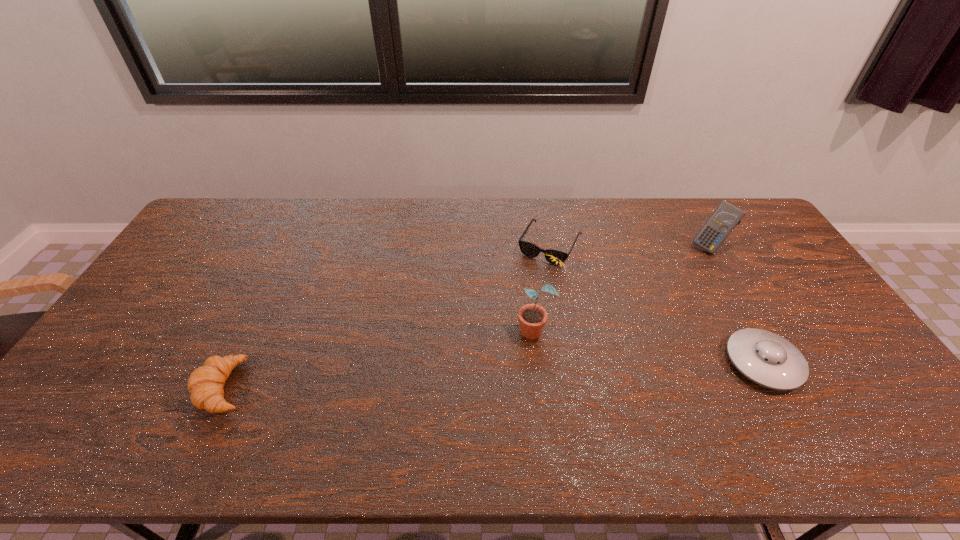
This screenshot has width=960, height=540. What are the coordinates of `vacant space at the far edge of the desktop` in the screenshot? It's located at (281, 202).

Identify the location of free region at the near edge of the desktop. (344, 410).

Where is `free region at the right edge of the desktop`? free region at the right edge of the desktop is located at coordinates (818, 323).

Where is `vacant region between the saucer and the calculator`? The width and height of the screenshot is (960, 540). vacant region between the saucer and the calculator is located at coordinates (736, 305).

Locate an element on the screen. This screenshot has height=540, width=960. vacant space that is in between the leftmost object and the fourth shortest object is located at coordinates (467, 317).

Locate an element on the screen. This screenshot has width=960, height=540. free spot between the sunglasses and the saucer is located at coordinates (657, 303).

Locate an element on the screen. The width and height of the screenshot is (960, 540). free space that is in between the sunglasses and the saucer is located at coordinates (657, 303).

I want to click on vacant space that is in between the fourth shortest object and the saucer, so click(x=736, y=305).

At what (x,y) coordinates should I click in order to perform the action: click on free space that is in between the calculator and the saucer. Please return your answer as a coordinate pair (x, y). The width and height of the screenshot is (960, 540). Looking at the image, I should click on (736, 305).

At what (x,y) coordinates should I click in order to perform the action: click on free point between the sunglasses and the calculator. Please return your answer as a coordinate pair (x, y). This screenshot has height=540, width=960. Looking at the image, I should click on (630, 246).